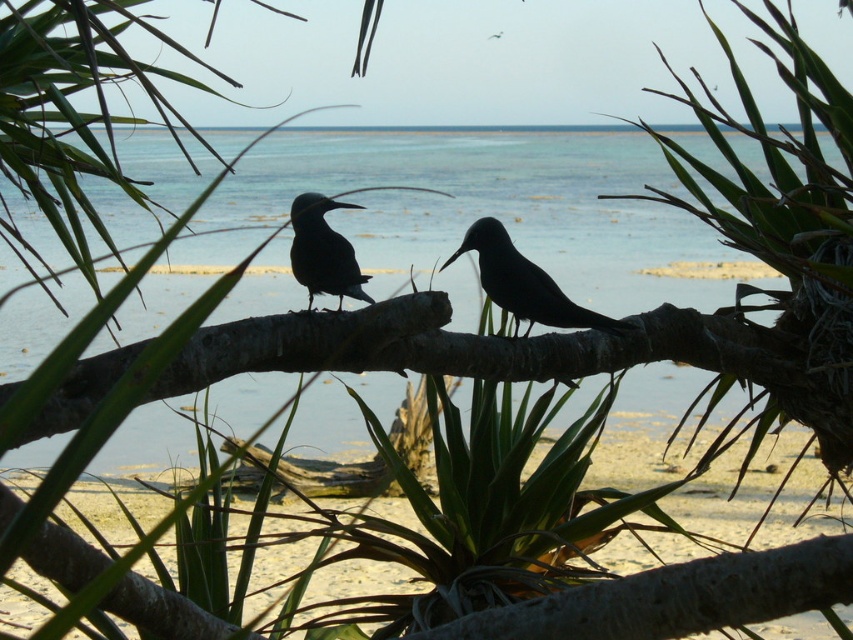
Question: Which point is closer to the camera?

Choices:
 (A) (308, 298)
 (B) (566, 316)
 (C) (780, 552)

Answer: (C)

Question: Does clear blue water at center appear under sandy beach at lower center?

Choices:
 (A) yes
 (B) no

Answer: (B)

Question: Does clear blue water at center have a larger size compared to black glossy bird at center?

Choices:
 (A) yes
 (B) no

Answer: (A)

Question: From the image, what is the correct spatial relationship of clear blue water at center in relation to shiny black bird at center?

Choices:
 (A) right
 (B) left

Answer: (B)

Question: Which object is the farthest from the shiny black bird at center?

Choices:
 (A) sandy beach at lower center
 (B) clear blue water at center
 (C) black glossy bird at center

Answer: (B)

Question: Estimate the real-world distances between objects in this image. Which object is farther from the black glossy bird at center?

Choices:
 (A) clear blue water at center
 (B) sandy beach at lower center
 (C) shiny black bird at center

Answer: (A)